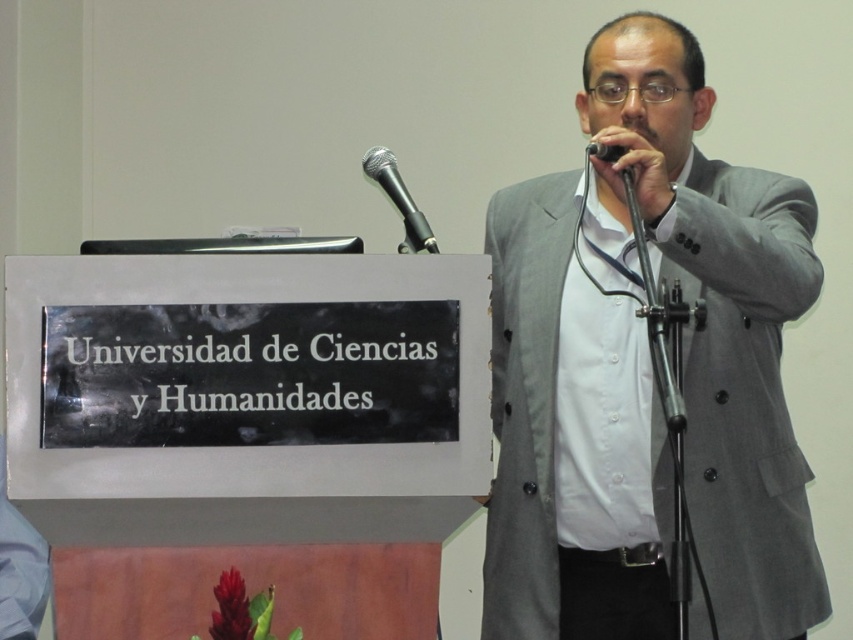
Question: Which point is closer to the camera?

Choices:
 (A) (553, 376)
 (B) (431, 234)

Answer: (B)

Question: From the image, what is the correct spatial relationship of gray fabric suit at center in relation to black metallic microphone at upper center?

Choices:
 (A) above
 (B) below

Answer: (B)

Question: Does gray fabric suit at center come behind black metallic microphone at upper center?

Choices:
 (A) no
 (B) yes

Answer: (A)

Question: Is gray fabric suit at center thinner than black metallic microphone at upper center?

Choices:
 (A) no
 (B) yes

Answer: (A)